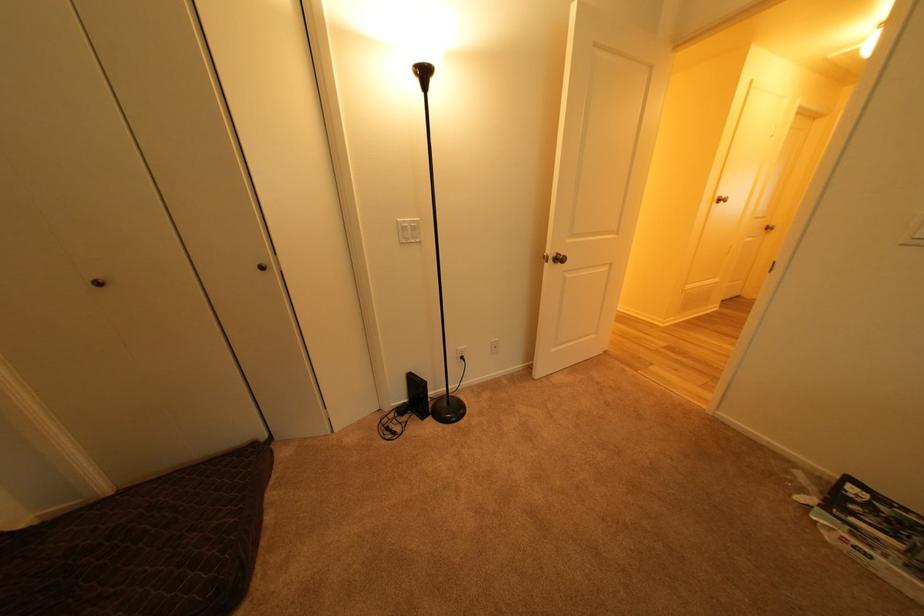
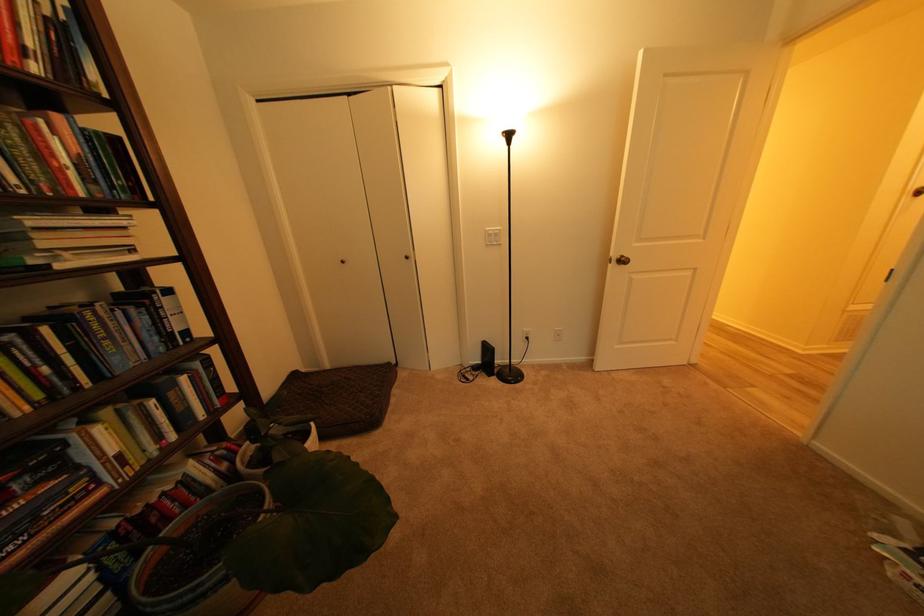
The point at (417,402) is marked in the first image. Where is the corresponding point in the second image?

(490, 363)